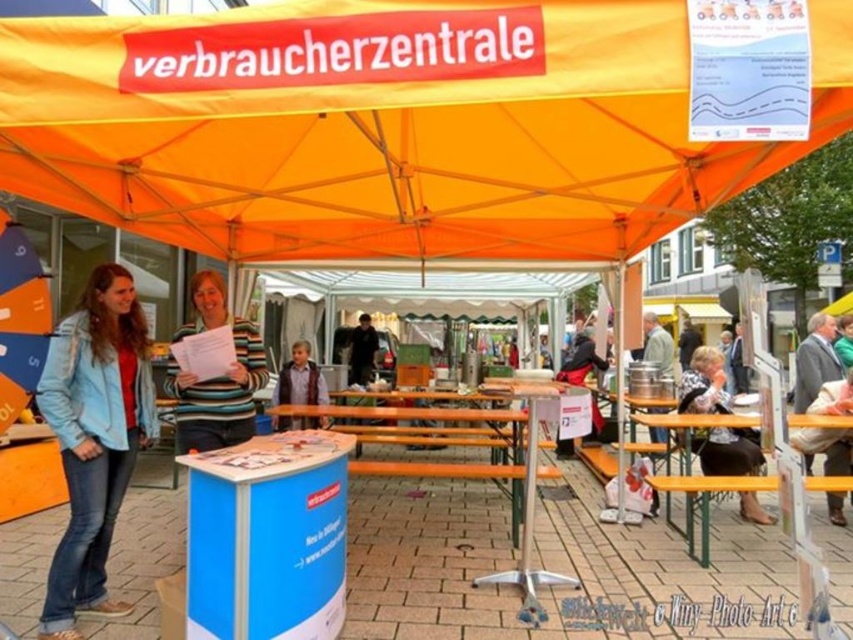
Question: Which object appears farthest from the camera in this image?

Choices:
 (A) blue denim jacket at lower left
 (B) orange fabric umbrella at left
 (C) black leather jacket at lower right
 (D) orange fabric canopy at upper center

Answer: (C)

Question: Which point is closer to the camera taking this photo?

Choices:
 (A) coord(525,586)
 (B) coord(344,509)
 (C) coord(4,372)
 (D) coord(756,161)

Answer: (B)

Question: Can you confirm if orange fabric canopy at upper center is smaller than blue denim jacket at lower left?

Choices:
 (A) yes
 (B) no

Answer: (B)

Question: Among these objects, which one is nearest to the camera?

Choices:
 (A) green wooden picnic table at center
 (B) blue denim jacket at lower left

Answer: (B)

Question: Is blue cardboard table at center positioned behind striped sweater at center?

Choices:
 (A) yes
 (B) no

Answer: (B)

Question: Does blue denim jacket at lower left have a lesser width compared to striped sweater at center?

Choices:
 (A) no
 (B) yes

Answer: (B)